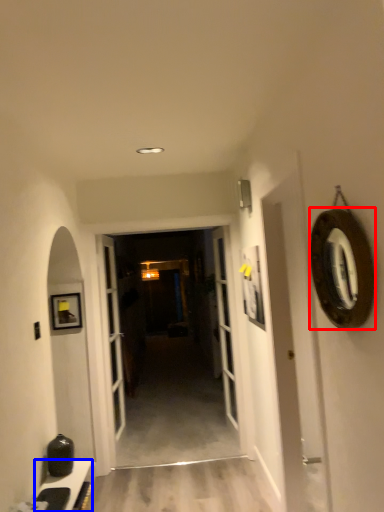
Question: Which point is further to the camera, oval (highlighted by a red box) or cabinetry (highlighted by a blue box)?

Choices:
 (A) oval
 (B) cabinetry

Answer: (B)